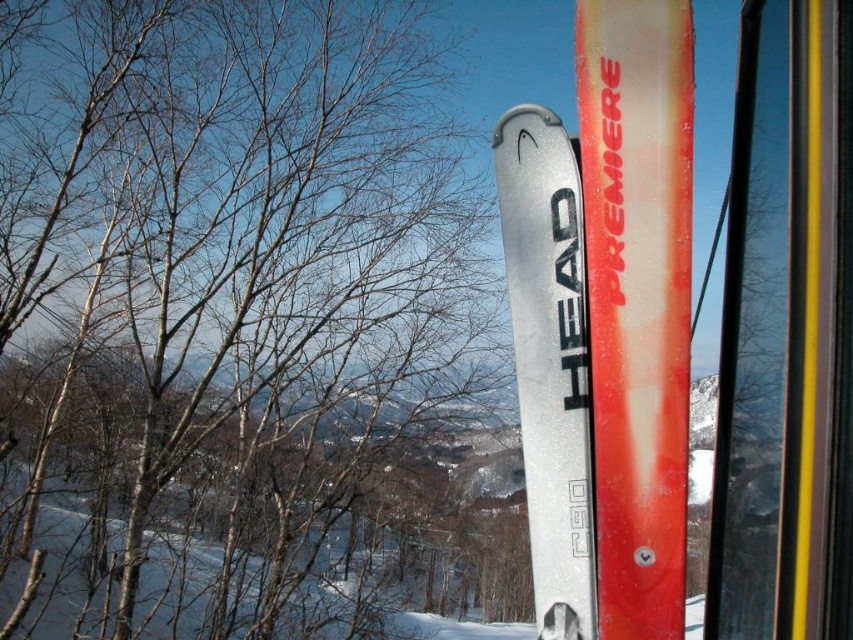
Describe the element at coordinates (231, 314) in the screenshot. I see `bare branches at upper left` at that location.

Consider the image. Which of these two, bare branches at upper left or satin silver ski at center, stands shorter?

bare branches at upper left is shorter.

In order to click on bare branches at upper left in this screenshot , I will do `click(231, 314)`.

Image resolution: width=853 pixels, height=640 pixels. Identify the location of bare branches at upper left. (231, 314).